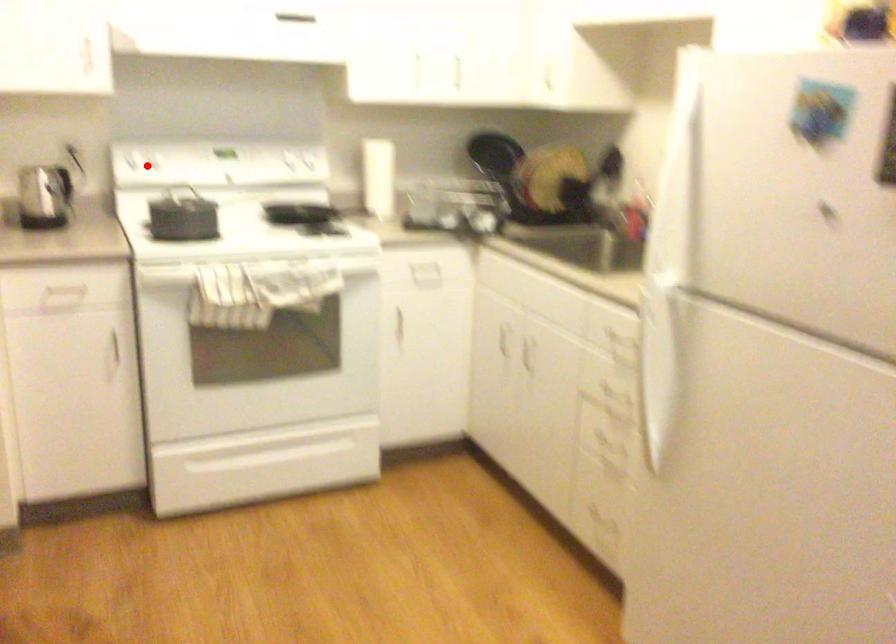
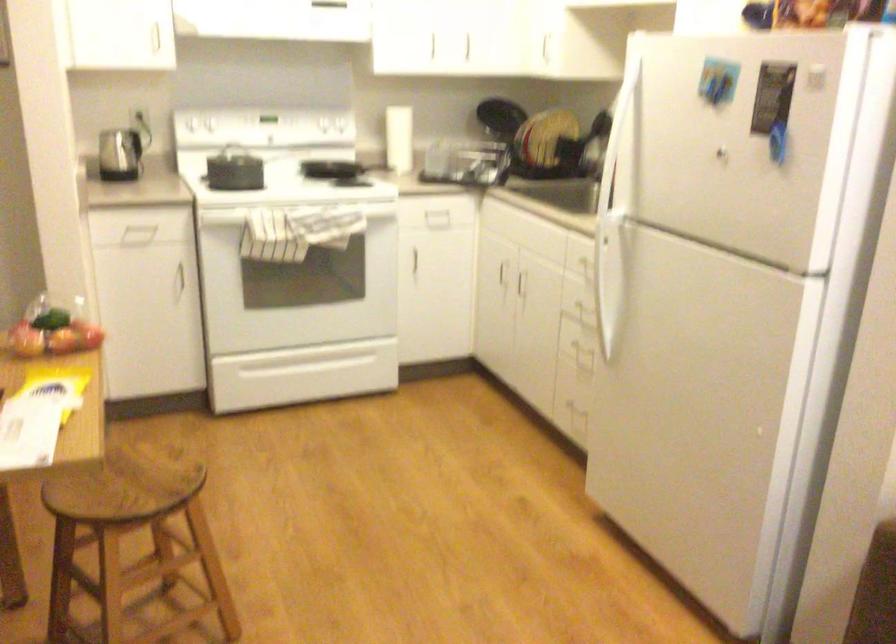
Question: A red point is marked in image1. In image2, is the corresponding 3D point closer to the camera or farther? Reply with the corresponding letter.

Choices:
 (A) The corresponding 3D point is closer.
 (B) The corresponding 3D point is farther.

Answer: (B)